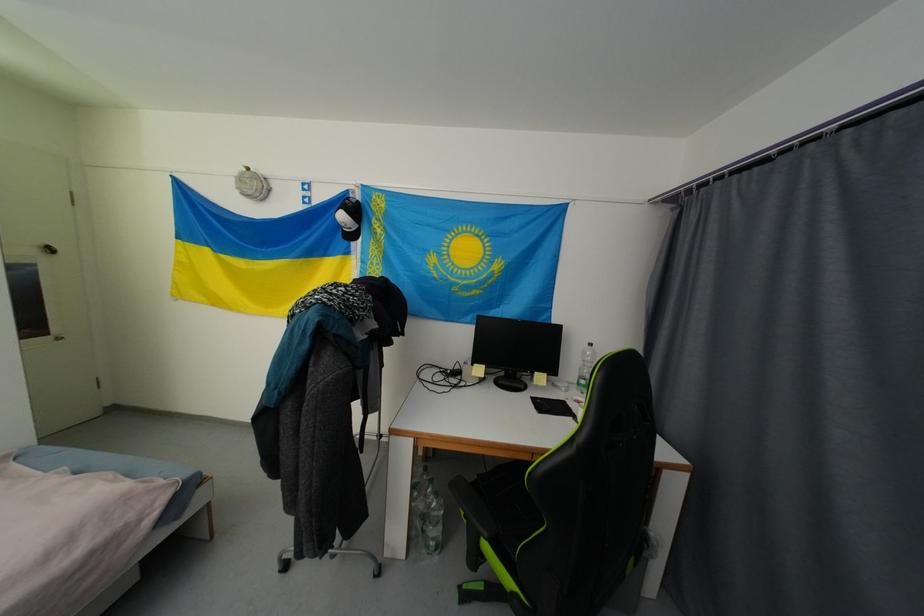
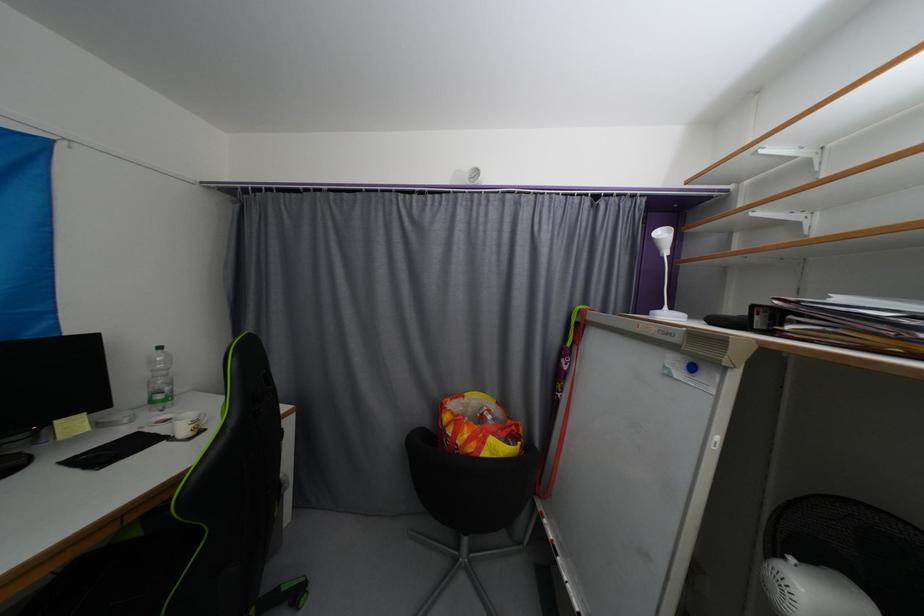
Where in the second image is the point corresponding to [584,386] from the first image?

(157, 403)